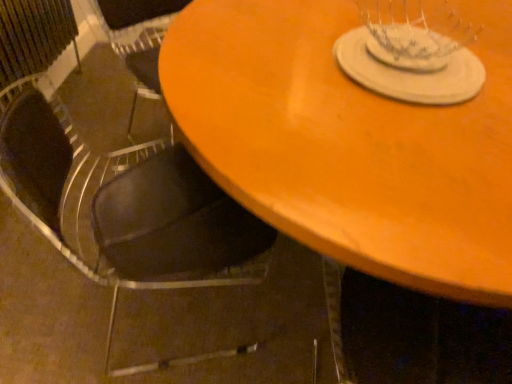
Describe the element at coordinates (124, 207) in the screenshot. This screenshot has height=384, width=512. I see `black leather chair at lower left` at that location.

This screenshot has width=512, height=384. What do you see at coordinates (410, 74) in the screenshot? I see `white matte glass plate at upper center` at bounding box center [410, 74].

You are a GUI agent. You are given a task and a screenshot of the screen. Output one action in this format:
    pyautogui.click(x=<x>, y=<y>)
    Task: Click on the black leather chair at lower left
    Image resolution: width=512 pixels, height=384 pixels.
    Given the screenshot: What is the action you would take?
    pyautogui.click(x=124, y=207)

From a real-world perspective, relative to white matte glass plate at upper center, is wooden table at center vertically above or below?

In terms of real-world spatial position, wooden table at center is below white matte glass plate at upper center.

Identify the location of table in front of the white matte glass plate at upper center. This screenshot has height=384, width=512. (349, 143).

Is wooden table at center turned away from white matte glass plate at upper center?

No, wooden table at center's orientation is not away from white matte glass plate at upper center.

This screenshot has height=384, width=512. Find the location of `glass plate lying above the wooden table at center (from the image's perspective)`. glass plate lying above the wooden table at center (from the image's perspective) is located at coordinates (410, 74).

From the image's perspective, relative to wooden table at center, is white matte glass plate at upper center above or below?

Clearly, from the image's perspective, white matte glass plate at upper center is above wooden table at center.

Considering the sizes of objects white matte glass plate at upper center and wooden table at center in the image provided, who is thinner, white matte glass plate at upper center or wooden table at center?

Thinner between the two is white matte glass plate at upper center.

From a real-world perspective, is white matte glass plate at upper center above or below wooden table at center?

In terms of real-world spatial position, white matte glass plate at upper center is above wooden table at center.

There is a black leather chair at lower left. In order to click on glass plate above it (from a real-world perspective) in this screenshot , I will do `click(410, 74)`.

From the image's perspective, relative to white matte glass plate at upper center, is black leather chair at lower left above or below?

black leather chair at lower left is situated lower than white matte glass plate at upper center in the image.

Which of these two, black leather chair at lower left or white matte glass plate at upper center, stands taller?

black leather chair at lower left.

Between black leather chair at lower left and white matte glass plate at upper center, which one has larger size?

black leather chair at lower left is bigger.

Who is shorter, white matte glass plate at upper center or black leather chair at lower left?

white matte glass plate at upper center.

How many degrees apart are the facing directions of white matte glass plate at upper center and black leather chair at lower left?

149 degrees separate the facing orientations of white matte glass plate at upper center and black leather chair at lower left.

From a real-world perspective, is white matte glass plate at upper center located beneath black leather chair at lower left?

No, from a real-world perspective, white matte glass plate at upper center is not beneath black leather chair at lower left.

From a real-world perspective, which object stands above the other?

black leather chair at lower left, from a real-world perspective.

You are a GUI agent. You are given a task and a screenshot of the screen. Output one action in this format:
    pyautogui.click(x=<x>, y=<y>)
    Task: Click on the table on the right of the black leather chair at lower left
    The height and width of the screenshot is (384, 512).
    Given the screenshot: What is the action you would take?
    pyautogui.click(x=349, y=143)

Looking at the image, does black leather chair at lower left seem bigger or smaller compared to wooden table at center?

Considering their sizes, black leather chair at lower left takes up less space than wooden table at center.

Does black leather chair at lower left contain wooden table at center?

No, wooden table at center is not a part of black leather chair at lower left.

Is wooden table at center not near black leather chair at lower left?

wooden table at center is near black leather chair at lower left, not far away.

What's the angular difference between wooden table at center and black leather chair at lower left's facing directions?

121 degrees separate the facing orientations of wooden table at center and black leather chair at lower left.

Looking at their sizes, would you say wooden table at center is wider or thinner than black leather chair at lower left?

wooden table at center is wider than black leather chair at lower left.

Between wooden table at center and black leather chair at lower left, which one has larger size?

wooden table at center.

In order to click on glass plate that is on the left side of wooden table at center in this screenshot , I will do `click(410, 74)`.

The image size is (512, 384). Find the location of `table below the white matte glass plate at upper center (from a real-world perspective)`. table below the white matte glass plate at upper center (from a real-world perspective) is located at coordinates (349, 143).

Based on their spatial positions, is black leather chair at lower left or wooden table at center further from white matte glass plate at upper center?

black leather chair at lower left lies further to white matte glass plate at upper center than the other object.

When comparing their distances from black leather chair at lower left, does white matte glass plate at upper center or wooden table at center seem further?

white matte glass plate at upper center.

Looking at the image, which one is located further to wooden table at center, black leather chair at lower left or white matte glass plate at upper center?

black leather chair at lower left is positioned further to the anchor wooden table at center.

Looking at the image, which one is located closer to white matte glass plate at upper center, wooden table at center or black leather chair at lower left?

wooden table at center is positioned closer to the anchor white matte glass plate at upper center.

Based on their spatial positions, is wooden table at center or white matte glass plate at upper center closer to black leather chair at lower left?

Based on the image, wooden table at center appears to be nearer to black leather chair at lower left.

Estimate the real-world distances between objects in this image. Which object is further from wooden table at center, white matte glass plate at upper center or black leather chair at lower left?

black leather chair at lower left is positioned further to the anchor wooden table at center.

Locate an element on the screen. The image size is (512, 384). glass plate between black leather chair at lower left and wooden table at center is located at coordinates (410, 74).